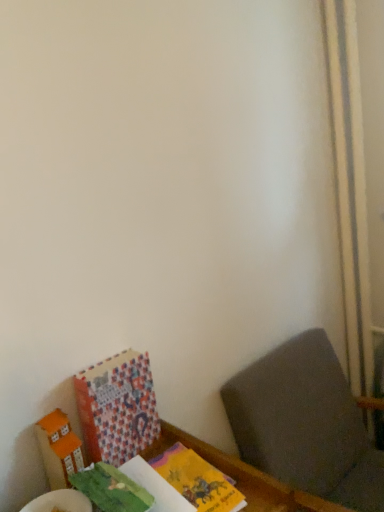
Question: Is there a large distance between patterned paper book at lower left and dark gray fabric at lower right?

Choices:
 (A) yes
 (B) no

Answer: (B)

Question: Is patterned paper book at lower left located outside dark gray fabric at lower right?

Choices:
 (A) yes
 (B) no

Answer: (A)

Question: Considering the relative positions of patterned paper book at lower left and dark gray fabric at lower right in the image provided, is patterned paper book at lower left behind dark gray fabric at lower right?

Choices:
 (A) no
 (B) yes

Answer: (B)

Question: Is patterned paper book at lower left wider than dark gray fabric at lower right?

Choices:
 (A) yes
 (B) no

Answer: (B)

Question: From a real-world perspective, is patterned paper book at lower left physically above dark gray fabric at lower right?

Choices:
 (A) yes
 (B) no

Answer: (A)

Question: Can you confirm if patterned paper book at lower left is shorter than dark gray fabric at lower right?

Choices:
 (A) no
 (B) yes

Answer: (B)

Question: From a real-world perspective, is patterned paper book at lower left under wooden table at lower left?

Choices:
 (A) no
 (B) yes

Answer: (A)

Question: Can you confirm if patterned paper book at lower left is positioned to the right of wooden table at lower left?

Choices:
 (A) yes
 (B) no

Answer: (B)

Question: Can we say patterned paper book at lower left lies outside wooden table at lower left?

Choices:
 (A) yes
 (B) no

Answer: (A)

Question: Considering the relative sizes of patterned paper book at lower left and wooden table at lower left in the image provided, is patterned paper book at lower left shorter than wooden table at lower left?

Choices:
 (A) no
 (B) yes

Answer: (A)

Question: Is patterned paper book at lower left in front of wooden table at lower left?

Choices:
 (A) no
 (B) yes

Answer: (A)

Question: Can you see patterned paper book at lower left touching wooden table at lower left?

Choices:
 (A) yes
 (B) no

Answer: (B)

Question: Is orange matte cardboard box at lower left not close to wooden table at lower left?

Choices:
 (A) no
 (B) yes

Answer: (A)